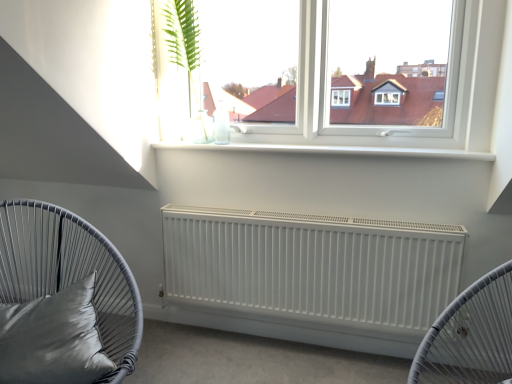
Question: Considering the positions of white matte radiator at center and matte gray cushion at left in the image, is white matte radiator at center bigger or smaller than matte gray cushion at left?

Choices:
 (A) big
 (B) small

Answer: (B)

Question: From a real-world perspective, is white matte radiator at center above or below matte gray cushion at left?

Choices:
 (A) above
 (B) below

Answer: (B)

Question: Estimate the real-world distances between objects in this image. Which object is farther from the green leafy plant at upper center?

Choices:
 (A) satin gray pillow at lower left
 (B) matte gray cushion at left
 (C) white matte radiator at center

Answer: (A)

Question: Which of these objects is positioned farthest from the satin gray pillow at lower left?

Choices:
 (A) matte gray cushion at left
 (B) white matte radiator at center
 (C) green leafy plant at upper center

Answer: (C)